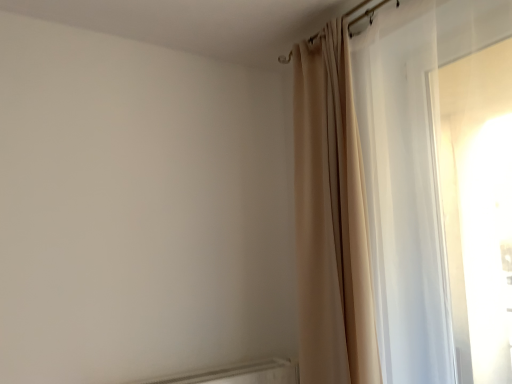
Question: Would you say beige fabric curtain at upper right, the second curtain when ordered from right to left, is to the left or to the right of sheer white curtain at right, the 2th curtain positioned from the left, in the picture?

Choices:
 (A) right
 (B) left

Answer: (B)

Question: Considering the positions of beige fabric curtain at upper right, arranged as the 1th curtain when viewed from the left, and sheer white curtain at right, the 2th curtain positioned from the left, in the image, is beige fabric curtain at upper right, arranged as the 1th curtain when viewed from the left, wider or thinner than sheer white curtain at right, the 2th curtain positioned from the left,?

Choices:
 (A) wide
 (B) thin

Answer: (A)

Question: In the image, is beige fabric curtain at upper right, arranged as the 1th curtain when viewed from the left, positioned in front of or behind sheer white curtain at right, the 2th curtain positioned from the left?

Choices:
 (A) behind
 (B) front

Answer: (A)

Question: From a real-world perspective, is sheer white curtain at right, the 2th curtain positioned from the left, physically located above or below beige fabric curtain at upper right, arranged as the 1th curtain when viewed from the left?

Choices:
 (A) above
 (B) below

Answer: (A)

Question: Does point (454, 299) appear closer or farther from the camera than point (352, 334)?

Choices:
 (A) closer
 (B) farther

Answer: (A)

Question: Based on their sizes in the image, would you say sheer white curtain at right, the 2th curtain positioned from the left, is bigger or smaller than beige fabric curtain at upper right, arranged as the 1th curtain when viewed from the left?

Choices:
 (A) small
 (B) big

Answer: (B)

Question: In terms of width, does sheer white curtain at right, which is counted as the 1th curtain, starting from the right, look wider or thinner when compared to beige fabric curtain at upper right, the second curtain when ordered from right to left?

Choices:
 (A) wide
 (B) thin

Answer: (B)